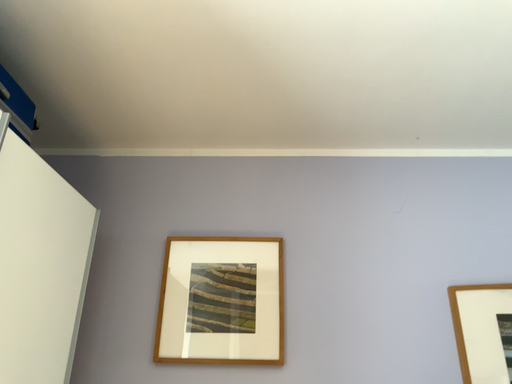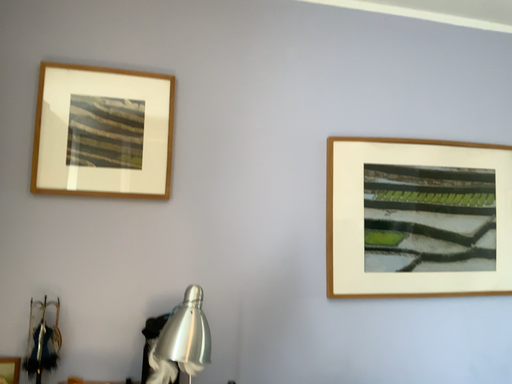
Question: Which way did the camera rotate in the video?

Choices:
 (A) rotated right
 (B) rotated left

Answer: (A)